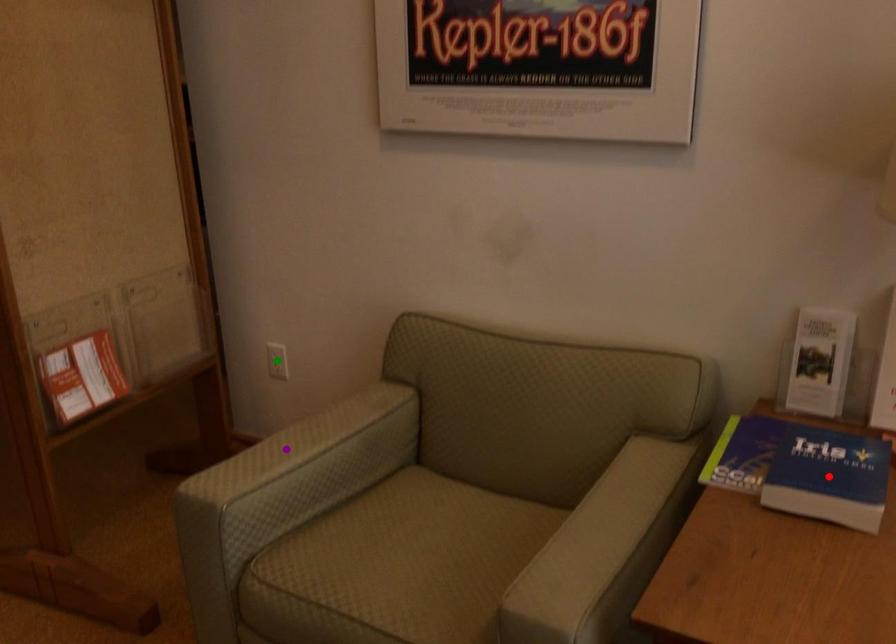
Order these from nearest to farthest:
green point, red point, purple point

1. green point
2. purple point
3. red point